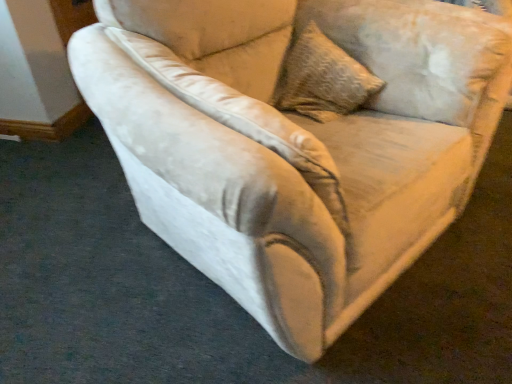
Image resolution: width=512 pixels, height=384 pixels. What are the coordinates of `textured beige pillow at upper right` in the screenshot? It's located at (322, 78).

What do you see at coordinates (322, 78) in the screenshot? I see `textured beige pillow at upper right` at bounding box center [322, 78].

In order to click on textured beige pillow at upper right in this screenshot , I will do `click(322, 78)`.